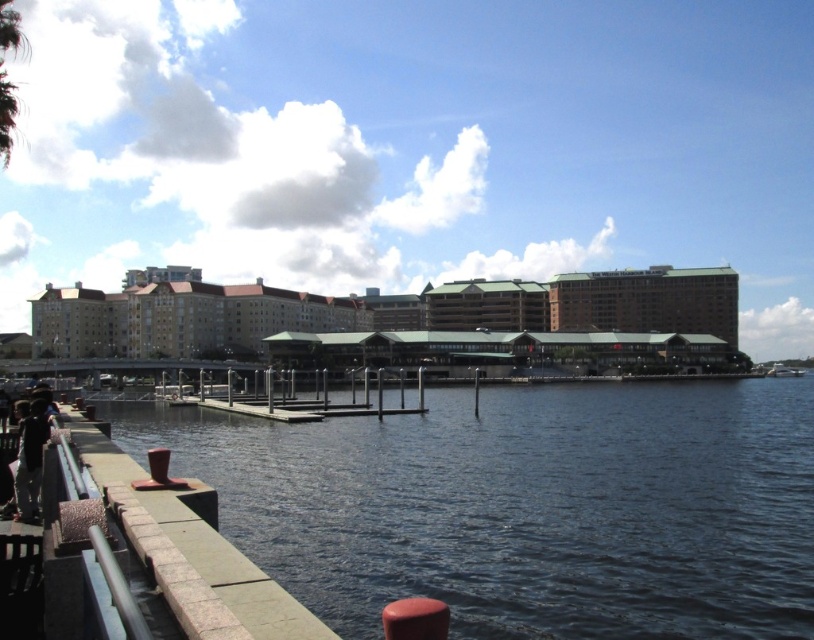
Question: Which is nearer to the dark clothing at lower left?

Choices:
 (A) white glossy boat at lower right
 (B) brown brick building at center
 (C) dark blue water at lower left

Answer: (C)

Question: Can you confirm if brown brick building at center is positioned to the right of dark clothing at lower left?

Choices:
 (A) yes
 (B) no

Answer: (A)

Question: Which object is positioned farthest from the white glossy boat at lower right?

Choices:
 (A) dark blue water at lower left
 (B) brown brick building at center

Answer: (A)

Question: Does brown brick building at center have a greater width compared to dark clothing at lower left?

Choices:
 (A) yes
 (B) no

Answer: (A)

Question: Among these points, which one is farthest from the camera?

Choices:
 (A) (20, 451)
 (B) (506, 352)
 (C) (584, 620)
 (D) (779, 376)

Answer: (D)

Question: Is brown brick building at center further to camera compared to white glossy boat at lower right?

Choices:
 (A) no
 (B) yes

Answer: (A)